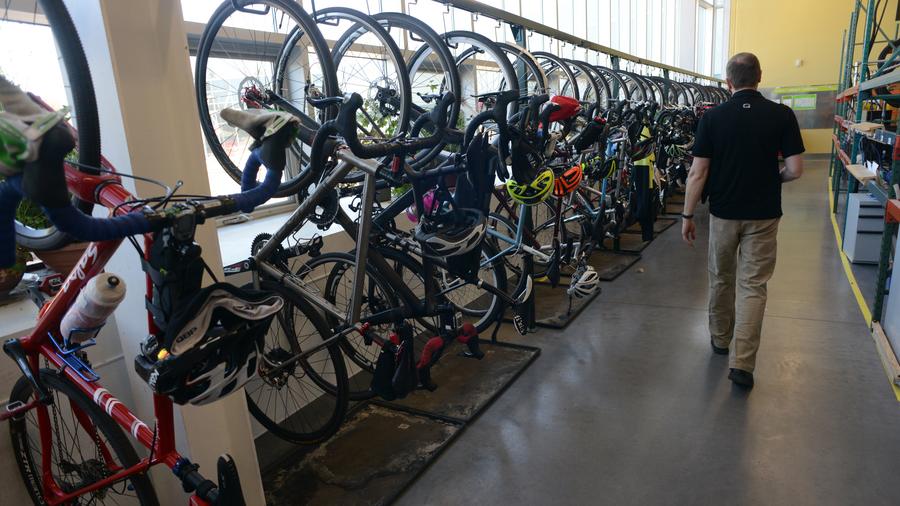
Where is `window`? Image resolution: width=900 pixels, height=506 pixels. window is located at coordinates (830, 108).